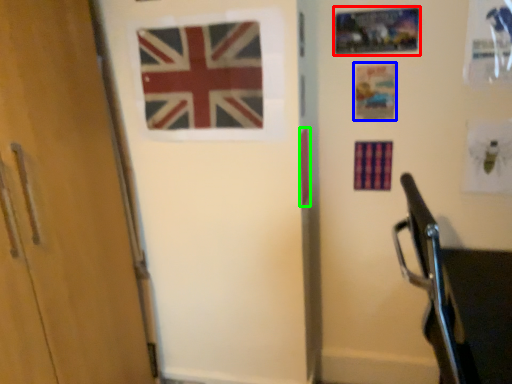
Question: Based on their relative distances, which object is nearer to postcard (highlighted by a red box)? Choose from postcard (highlighted by a blue box) and flag (highlighted by a green box).

Choices:
 (A) postcard
 (B) flag

Answer: (A)